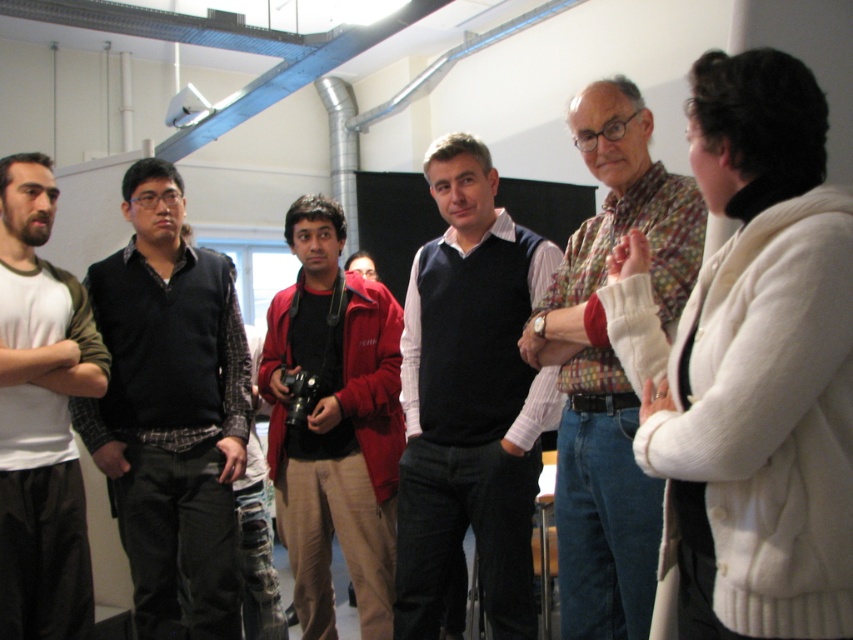
Which is more to the right, red jacket at center or matte white t-shirt at left?

Positioned to the right is red jacket at center.

Between point (270, 422) and point (3, 604), which one is positioned behind?

Positioned behind is point (270, 422).

Identify the location of red jacket at center. Image resolution: width=853 pixels, height=640 pixels. (334, 424).

Can you confirm if multicolored woven vest at center is bigger than red jacket at center?

Actually, multicolored woven vest at center might be smaller than red jacket at center.

Can you confirm if multicolored woven vest at center is taller than red jacket at center?

In fact, multicolored woven vest at center may be shorter than red jacket at center.

The image size is (853, 640). What do you see at coordinates (610, 365) in the screenshot?
I see `multicolored woven vest at center` at bounding box center [610, 365].

At what (x,y) coordinates should I click in order to perform the action: click on multicolored woven vest at center. Please return your answer as a coordinate pair (x, y). Looking at the image, I should click on (610, 365).

Describe the element at coordinates (170, 412) in the screenshot. This screenshot has width=853, height=640. I see `plaid shirt at left` at that location.

Consider the image. Between plaid shirt at left and red jacket at center, which one is positioned lower?

red jacket at center is below.

In order to click on plaid shirt at left in this screenshot , I will do `click(170, 412)`.